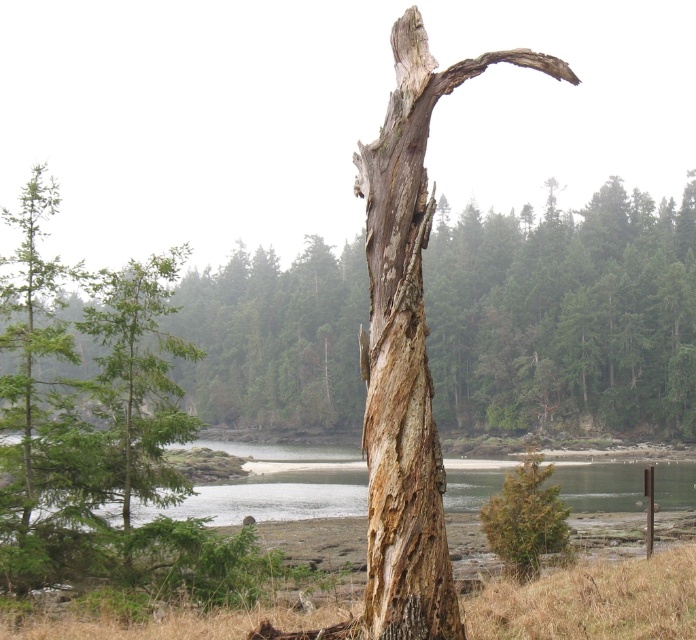
Does weathered brown tree trunk at center have a larger size compared to brown textured wood at center?

Indeed, weathered brown tree trunk at center has a larger size compared to brown textured wood at center.

Find the location of a particular element. The height and width of the screenshot is (640, 696). weathered brown tree trunk at center is located at coordinates (564, 316).

Is point (528, 317) positioned before point (383, 522)?

No, (528, 317) is further to viewer.

You are a GUI agent. You are given a task and a screenshot of the screen. Output one action in this format:
    pyautogui.click(x=<x>, y=<y>)
    Task: Click on the weathered brown tree trunk at center
    The image size is (696, 640).
    Given the screenshot: What is the action you would take?
    pyautogui.click(x=564, y=316)

Is dry grass at center bigger than brown rough tree at lower right?

Indeed, dry grass at center has a larger size compared to brown rough tree at lower right.

The height and width of the screenshot is (640, 696). What do you see at coordinates (592, 602) in the screenshot? I see `dry grass at center` at bounding box center [592, 602].

Find the location of a particular element. Image resolution: width=696 pixels, height=640 pixels. dry grass at center is located at coordinates (592, 602).

Is brown textured wood at center shorter than dry grass at center?

Incorrect, brown textured wood at center's height does not fall short of dry grass at center's.

Looking at this image, who is positioned more to the right, brown textured wood at center or dry grass at center?

dry grass at center is more to the right.

Who is more distant from viewer, (x=367, y=586) or (x=658, y=605)?

Positioned behind is point (x=658, y=605).

Where is `brown textured wood at center`? Image resolution: width=696 pixels, height=640 pixels. brown textured wood at center is located at coordinates (409, 348).